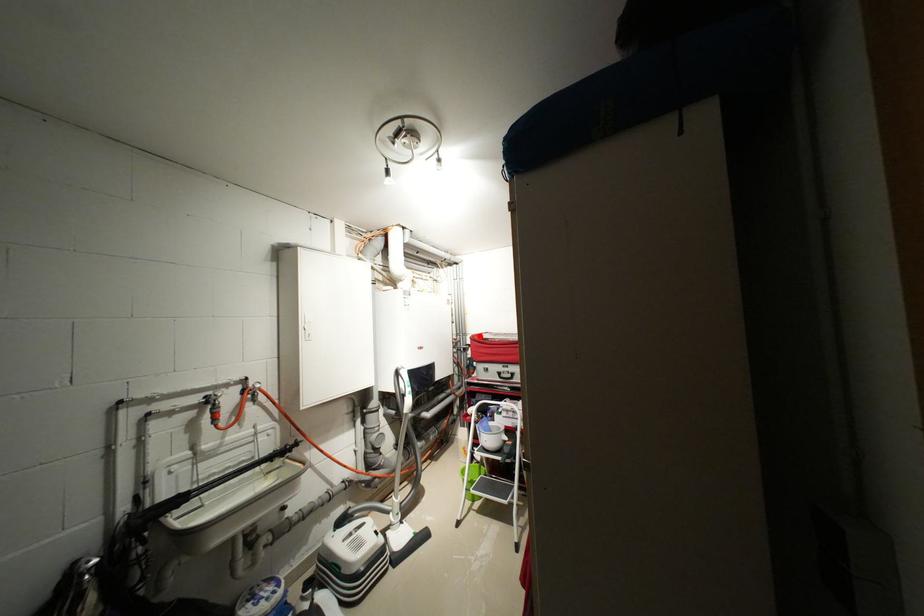
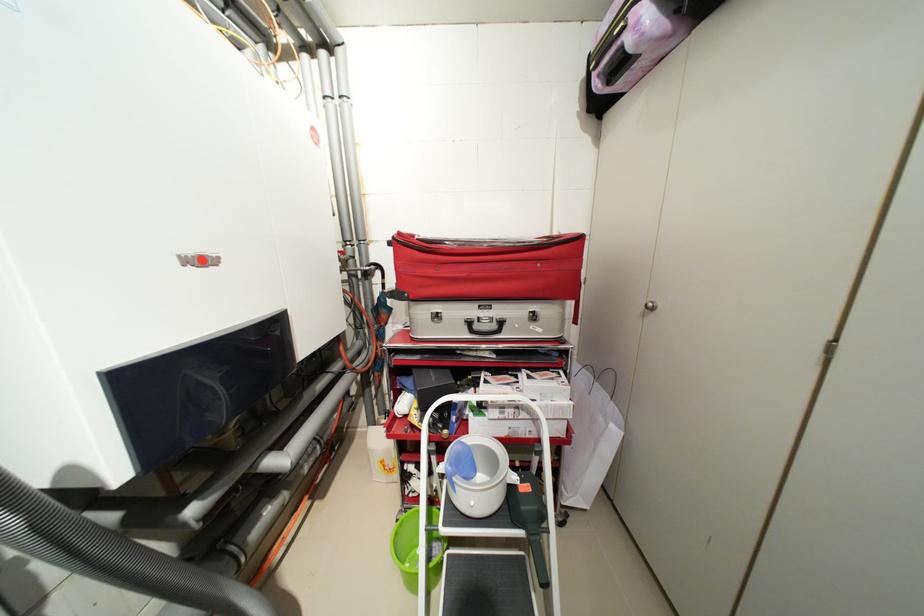
Where in the second image is the point corresponding to the highlighted location from the first image?

(407, 235)